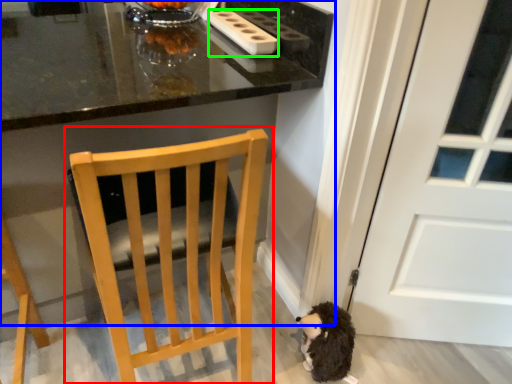
Question: Which object is the farthest from chair (highlighted by a red box)? Choose among these: table (highlighted by a blue box) or appliance (highlighted by a green box).

Choices:
 (A) table
 (B) appliance

Answer: (B)